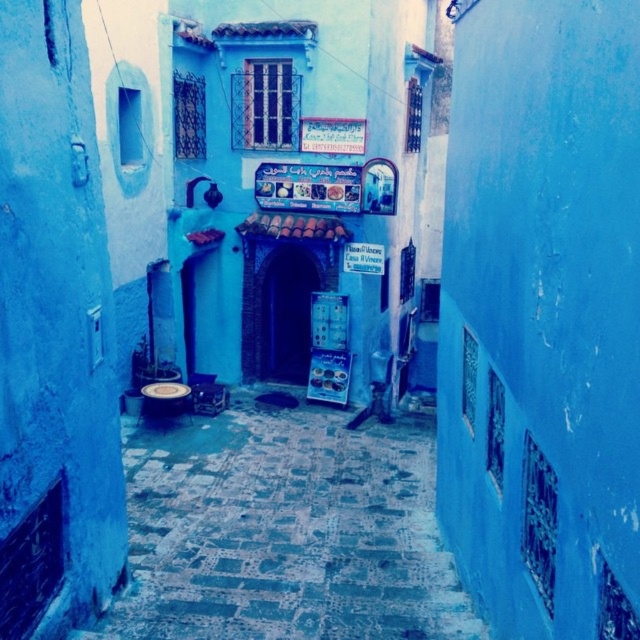
You are a traveler standing in the narrow alleyway surrounded by blue walls. You see the smooth cobblestone alley at center and the wooden stool at center. Which object is taller?

The wooden stool at center is taller than the smooth cobblestone alley at center.

You are a traveler carrying a large backpack and need to sit down for a rest. You see a smooth cobblestone alley at center and a wooden stool at center. Which one is more suitable for sitting comfortably?

The wooden stool at center is more suitable for sitting comfortably because the smooth cobblestone alley at center occupies less space than the wooden stool at center, implying the stool has a larger seating area.